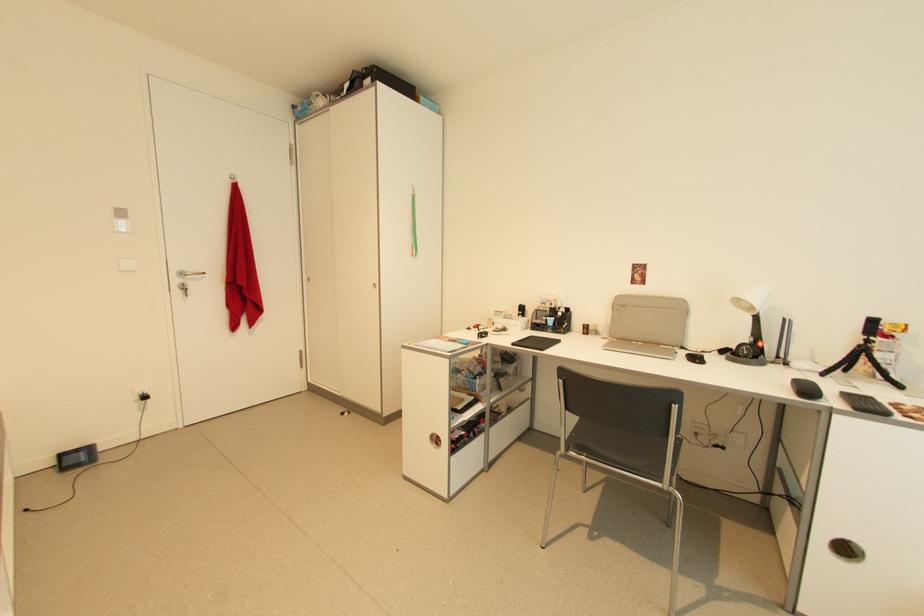
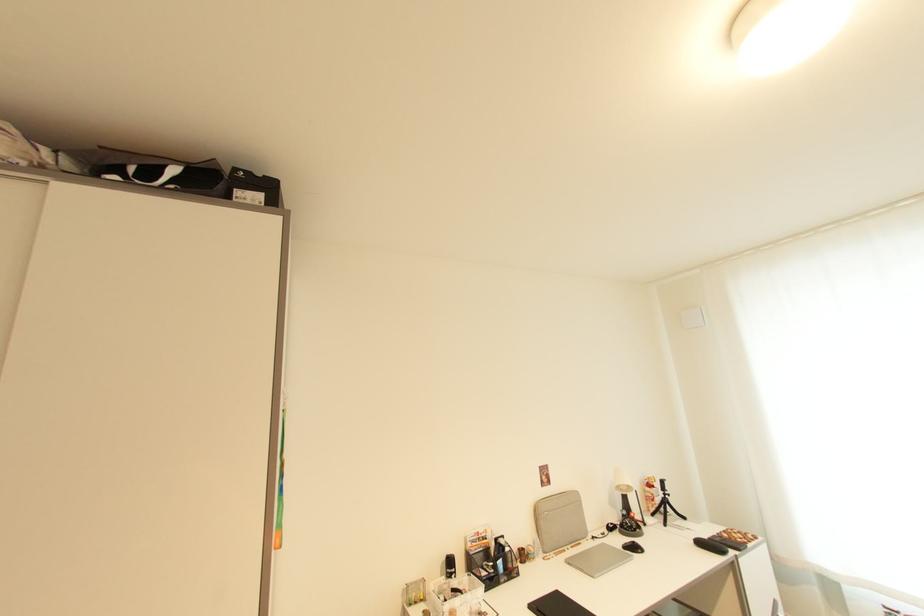
In the second image, find the point that corresponds to point (374, 82) in the first image.

(264, 198)